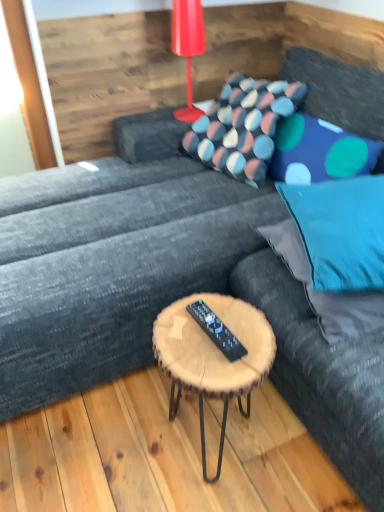
Question: Based on their sizes in the image, would you say shiny red plastic table lamp at upper center is bigger or smaller than teal fabric bean bag at center?

Choices:
 (A) big
 (B) small

Answer: (B)

Question: Based on their positions, is shiny red plastic table lamp at upper center located to the left or right of teal fabric bean bag at center?

Choices:
 (A) right
 (B) left

Answer: (B)

Question: Which of these objects is positioned closest to the polka dot fabric pillow at center, acting as the fourth pillow starting from the front?

Choices:
 (A) woodenmaterial/texturecoffee table at center
 (B) teal fabric pillow at right, marked as the second pillow in a front-to-back arrangement
 (C) blue fabric pillow at right, the 4th pillow in the back-to-front sequence
 (D) shiny red plastic table lamp at upper center
 (E) teal fabric bean bag at center

Answer: (D)

Question: Considering the real-world distances, which object is closest to the teal fabric pillow at right, marked as the second pillow in a front-to-back arrangement?

Choices:
 (A) teal fabric bean bag at center
 (B) woodenmaterial/texturecoffee table at center
 (C) black plastic remote at center
 (D) blue fabric pillow at upper right, acting as the 2th pillow starting from the back
 (E) blue fabric pillow at right, the first pillow from the front

Answer: (E)